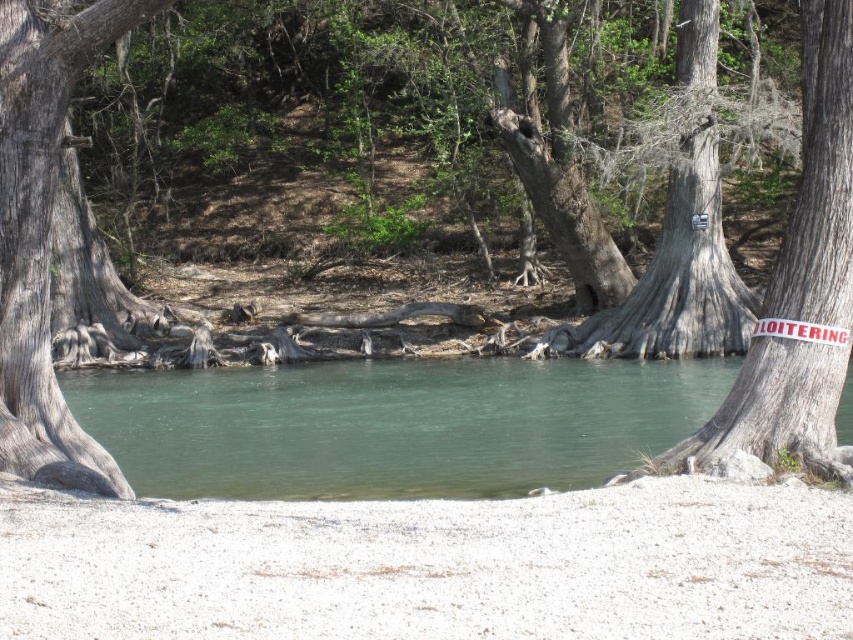
Question: Which of the following is the farthest from the observer?

Choices:
 (A) (553, 376)
 (B) (786, 268)
 (C) (33, 140)
 (D) (793, 336)

Answer: (A)

Question: Which point appears farthest from the camera in this image?

Choices:
 (A) (805, 337)
 (B) (840, 385)
 (C) (39, 422)

Answer: (C)

Question: Which point is closer to the camera taking this photo?

Choices:
 (A) 816,436
 (B) 837,326
 (C) 61,477

Answer: (A)

Question: Is gray rough bark tree trunk at left positioned at the back of white painted wood sign at center?

Choices:
 (A) no
 (B) yes

Answer: (B)

Question: Is clear water at center wider than gray rough tree trunk at center right?

Choices:
 (A) no
 (B) yes

Answer: (B)

Question: Can you confirm if gray rough tree trunk at center right is bigger than gray rough bark tree trunk at left?

Choices:
 (A) no
 (B) yes

Answer: (B)